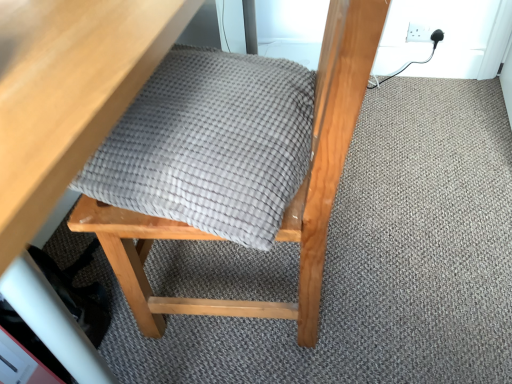
This screenshot has width=512, height=384. What do you see at coordinates (423, 33) in the screenshot? I see `white plastic socket at upper right` at bounding box center [423, 33].

What do you see at coordinates (288, 207) in the screenshot? I see `matte gray cushion at center` at bounding box center [288, 207].

Identify the location of white plastic socket at upper right. (423, 33).

Relative to matte gray cushion at center, is white plastic socket at upper right in front or behind?

Visually, white plastic socket at upper right is located behind matte gray cushion at center.

Is white plastic socket at upper right not near matte gray cushion at center?

Yes.

Who is shorter, white plastic socket at upper right or matte gray cushion at center?

white plastic socket at upper right.

From the image's perspective, is white plastic socket at upper right on top of matte gray cushion at center?

Correct, white plastic socket at upper right appears higher than matte gray cushion at center in the image.

Does gray woven blanket at center contain white plastic socket at upper right?

Definitely not — white plastic socket at upper right is not inside gray woven blanket at center.

From the image's perspective, is gray woven blanket at center below white plastic socket at upper right?

Yes, from the image's perspective, gray woven blanket at center is beneath white plastic socket at upper right.

Which object is positioned more to the left, gray woven blanket at center or white plastic socket at upper right?

gray woven blanket at center.

From the picture: Considering the sizes of wooden table at upper left and gray woven blanket at center in the image, is wooden table at upper left taller or shorter than gray woven blanket at center?

In the image, wooden table at upper left appears to be taller than gray woven blanket at center.

From a real-world perspective, which is physically below, wooden table at upper left or gray woven blanket at center?

In real-world perspective, wooden table at upper left is lower.

Between wooden table at upper left and gray woven blanket at center, which one appears on the left side from the viewer's perspective?

wooden table at upper left.

Considering the sizes of objects wooden table at upper left and gray woven blanket at center in the image provided, who is thinner, wooden table at upper left or gray woven blanket at center?

Thinner between the two is gray woven blanket at center.

Is matte gray cushion at center outside of wooden table at upper left?

No, matte gray cushion at center is inside or overlapping with wooden table at upper left.

Is point (306, 284) positioned behind point (105, 5)?

Yes, point (306, 284) is behind point (105, 5).

In the scene shown: From a real-world perspective, relative to wooden table at upper left, is matte gray cushion at center vertically above or below?

From a real-world perspective, matte gray cushion at center is physically above wooden table at upper left.

Is matte gray cushion at center positioned with its back to wooden table at upper left?

Yes, matte gray cushion at center's orientation is away from wooden table at upper left.

Is matte gray cushion at center a part of wooden table at upper left?

Yes, matte gray cushion at center can be found within wooden table at upper left.

Is wooden table at upper left to the left of matte gray cushion at center from the viewer's perspective?

Correct, you'll find wooden table at upper left to the left of matte gray cushion at center.

Between point (81, 111) and point (261, 305), which one is positioned behind?

The point (261, 305) is farther.

Which of these two, wooden table at upper left or matte gray cushion at center, is bigger?

Bigger between the two is wooden table at upper left.

Who is smaller, matte gray cushion at center or white plastic socket at upper right?

white plastic socket at upper right is smaller.

Can you confirm if matte gray cushion at center is shorter than white plastic socket at upper right?

In fact, matte gray cushion at center may be taller than white plastic socket at upper right.

From the image's perspective, which object appears higher, matte gray cushion at center or white plastic socket at upper right?

From the image's view, white plastic socket at upper right is above.

Which is closer, (338, 182) or (435, 38)?

Clearly, point (338, 182) is closer to the camera than point (435, 38).

Between gray woven blanket at center and wooden table at upper left, which one has less height?

gray woven blanket at center is shorter.

Can you confirm if gray woven blanket at center is wider than wooden table at upper left?

In fact, gray woven blanket at center might be narrower than wooden table at upper left.

From the image's perspective, is gray woven blanket at center on top of wooden table at upper left?

No, from the image's perspective, gray woven blanket at center is not on top of wooden table at upper left.

Which is more to the left, gray woven blanket at center or wooden table at upper left?

From the viewer's perspective, wooden table at upper left appears more on the left side.

In order to click on chair that is in front of the white plastic socket at upper right in this screenshot , I will do `click(288, 207)`.

This screenshot has height=384, width=512. Find the location of `electric outlet lying behind the gray woven blanket at center`. electric outlet lying behind the gray woven blanket at center is located at coordinates point(423,33).

Estimate the real-world distances between objects in this image. Which object is further from gray woven blanket at center, wooden table at upper left or matte gray cushion at center?

wooden table at upper left is further to gray woven blanket at center.

Considering their positions, is white plastic socket at upper right positioned closer to matte gray cushion at center than wooden table at upper left?

wooden table at upper left lies closer to matte gray cushion at center than the other object.

When comparing their distances from wooden table at upper left, does matte gray cushion at center or gray woven blanket at center seem closer?

gray woven blanket at center is positioned closer to the anchor wooden table at upper left.

From the picture: When comparing their distances from wooden table at upper left, does white plastic socket at upper right or matte gray cushion at center seem closer?

matte gray cushion at center is positioned closer to the anchor wooden table at upper left.

Considering their positions, is gray woven blanket at center positioned closer to matte gray cushion at center than white plastic socket at upper right?

gray woven blanket at center lies closer to matte gray cushion at center than the other object.

Which object lies nearer to the anchor point white plastic socket at upper right, wooden table at upper left or gray woven blanket at center?

gray woven blanket at center is closer to white plastic socket at upper right.

In the scene shown: Estimate the real-world distances between objects in this image. Which object is closer to wooden table at upper left, gray woven blanket at center or matte gray cushion at center?

Among the two, gray woven blanket at center is located nearer to wooden table at upper left.

From the image, which object appears to be farther from matte gray cushion at center, wooden table at upper left or gray woven blanket at center?

wooden table at upper left lies further to matte gray cushion at center than the other object.

The height and width of the screenshot is (384, 512). I want to click on blanket between matte gray cushion at center and white plastic socket at upper right from front to back, so click(210, 144).

Identify the location of chair between wooden table at upper left and white plastic socket at upper right in the front-back direction. The width and height of the screenshot is (512, 384). (288, 207).

Identify the location of chair located between wooden table at upper left and gray woven blanket at center in the left-right direction. This screenshot has width=512, height=384. (288, 207).

Where is `blanket located between wooden table at upper left and white plastic socket at upper right in the depth direction`? blanket located between wooden table at upper left and white plastic socket at upper right in the depth direction is located at coordinates (210, 144).